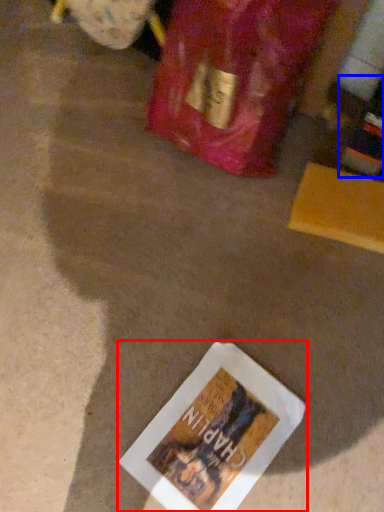
Question: Which of the following is the closest to the observer, book (highlighted by a red box) or wine bottle (highlighted by a blue box)?

Choices:
 (A) book
 (B) wine bottle

Answer: (B)